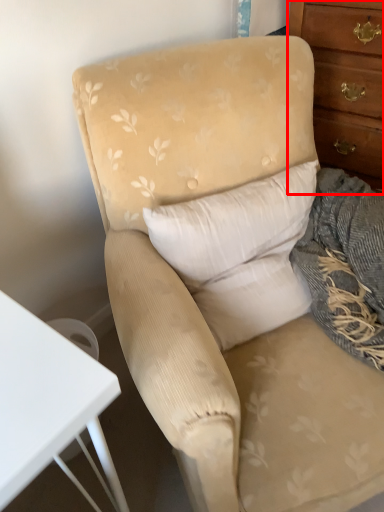
Question: In this image, where is chest of drawers (annotated by the red box) located relative to pillow?

Choices:
 (A) right
 (B) left

Answer: (A)